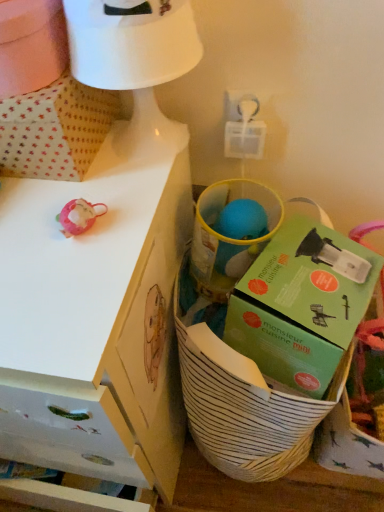
Question: Is white dotted fabric at upper left turned away from white striped basket at lower right?

Choices:
 (A) no
 (B) yes

Answer: (A)

Question: Is white dotted fabric at upper left outside of white striped basket at lower right?

Choices:
 (A) no
 (B) yes

Answer: (B)

Question: From a real-world perspective, is white dotted fabric at upper left physically below white striped basket at lower right?

Choices:
 (A) no
 (B) yes

Answer: (A)

Question: Does white dotted fabric at upper left contain white striped basket at lower right?

Choices:
 (A) no
 (B) yes

Answer: (A)

Question: Does white dotted fabric at upper left have a lesser width compared to white striped basket at lower right?

Choices:
 (A) no
 (B) yes

Answer: (B)

Question: From a real-world perspective, is white matte desk at upper left positioned above or below white striped basket at lower right?

Choices:
 (A) below
 (B) above

Answer: (B)

Question: Considering the positions of white matte desk at upper left and white striped basket at lower right in the image, is white matte desk at upper left wider or thinner than white striped basket at lower right?

Choices:
 (A) wide
 (B) thin

Answer: (A)

Question: Which is correct: white matte desk at upper left is inside white striped basket at lower right, or outside of it?

Choices:
 (A) inside
 (B) outside

Answer: (B)

Question: Would you say white matte desk at upper left is to the left or to the right of white striped basket at lower right in the picture?

Choices:
 (A) right
 (B) left

Answer: (B)

Question: Based on their sizes in the image, would you say green cardboard box at center is bigger or smaller than white striped basket at lower right?

Choices:
 (A) big
 (B) small

Answer: (B)

Question: From a real-world perspective, is green cardboard box at center positioned above or below white striped basket at lower right?

Choices:
 (A) above
 (B) below

Answer: (A)

Question: Looking at their shapes, would you say green cardboard box at center is wider or thinner than white striped basket at lower right?

Choices:
 (A) wide
 (B) thin

Answer: (B)

Question: From the image's perspective, is green cardboard box at center positioned above or below white striped basket at lower right?

Choices:
 (A) above
 (B) below

Answer: (A)

Question: In the image, is white matte table lamp at upper center on the left side or the right side of white dotted fabric at upper left?

Choices:
 (A) right
 (B) left

Answer: (A)

Question: Considering their positions, is white matte table lamp at upper center located in front of or behind white dotted fabric at upper left?

Choices:
 (A) front
 (B) behind

Answer: (A)